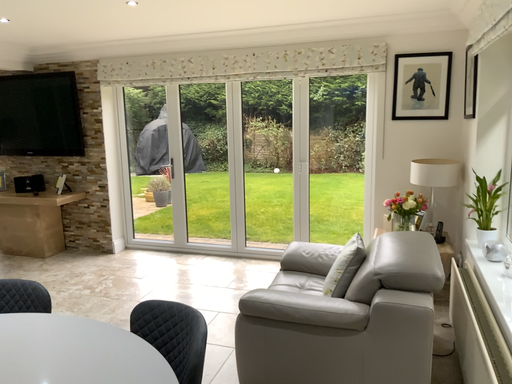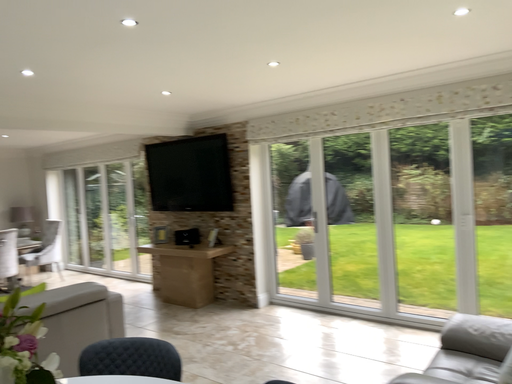
Question: How did the camera likely rotate when shooting the video?

Choices:
 (A) rotated downward
 (B) rotated upward

Answer: (B)